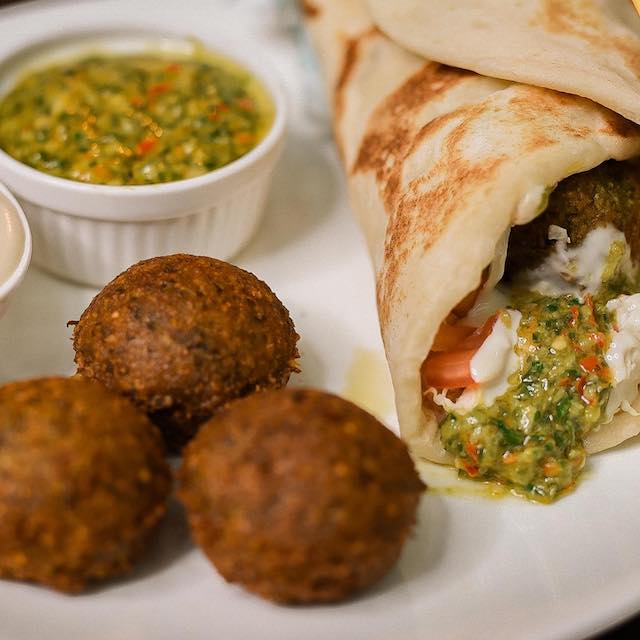
This screenshot has height=640, width=640. What are the coordinates of `sauce cup` in the screenshot? It's located at (111, 240).